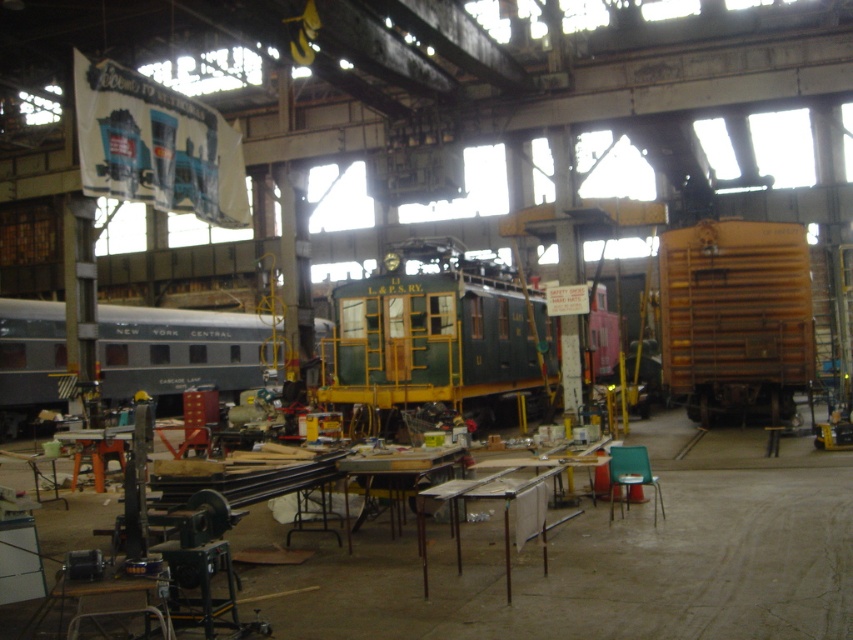
In the scene shown: Which is more to the left, green matte train car at center or rustic wood grain train car at right?

green matte train car at center is more to the left.

Measure the distance from green matte train car at center to rustic wood grain train car at right.

They are 4.55 meters apart.

What are the coordinates of `green matte train car at center` in the screenshot? It's located at (434, 333).

Can you confirm if rustic wood grain train car at right is thinner than silver polished metal train car at left?

Indeed, rustic wood grain train car at right has a lesser width compared to silver polished metal train car at left.

Which is above, rustic wood grain train car at right or silver polished metal train car at left?

rustic wood grain train car at right

Image resolution: width=853 pixels, height=640 pixels. In order to click on rustic wood grain train car at right in this screenshot , I will do `click(735, 317)`.

You are a GUI agent. You are given a task and a screenshot of the screen. Output one action in this format:
    pyautogui.click(x=<x>, y=<y>)
    Task: Click on the rustic wood grain train car at right
    This screenshot has height=640, width=853.
    Given the screenshot: What is the action you would take?
    pyautogui.click(x=735, y=317)

Which is more to the left, green matte train car at center or silver polished metal train car at left?

Positioned to the left is silver polished metal train car at left.

Is point (445, 371) positioned behind point (177, 336)?

No, it is not.

Locate an element on the screen. green matte train car at center is located at coordinates (434, 333).